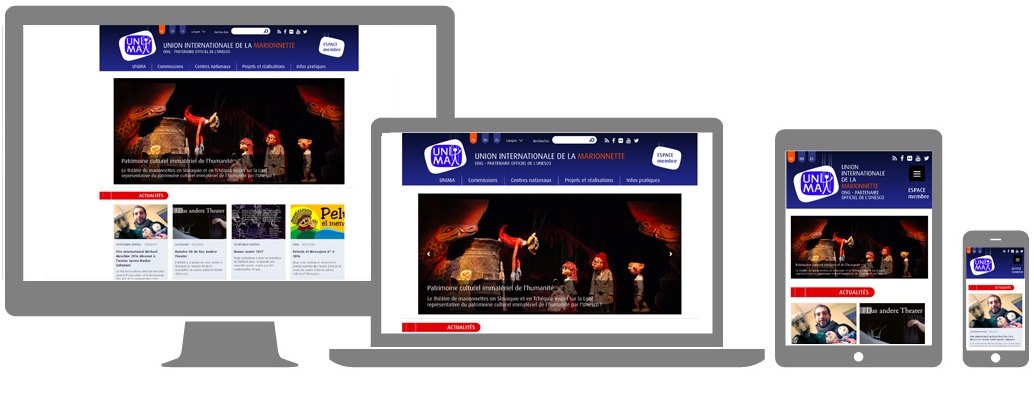
Locate an element on the screen. laptop screen is located at coordinates (699, 294).